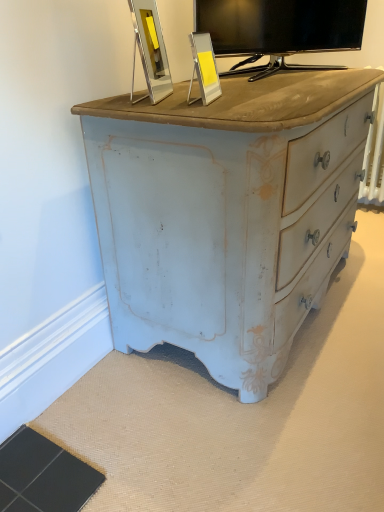
How much space does silver metallic picture frame at upper center, the 2th picture frame from the right, occupy horizontally?

It is 2.15 inches.

At what (x,y) coordinates should I click in order to perform the action: click on metallic silver picture frame at upper center, acting as the 2th picture frame starting from the left. Please return your answer as a coordinate pair (x, y). The width and height of the screenshot is (384, 512). Looking at the image, I should click on (204, 68).

I want to click on picture frame on the right of silver metallic picture frame at upper center, the 2th picture frame from the right, so click(x=204, y=68).

From the image's perspective, is silver metallic picture frame at upper center, the 2th picture frame from the right, above or below metallic silver picture frame at upper center, which is the 1th picture frame from right to left?

From the image's perspective, silver metallic picture frame at upper center, the 2th picture frame from the right, appears above metallic silver picture frame at upper center, which is the 1th picture frame from right to left.

From a real-world perspective, which object stands above the other?

silver metallic picture frame at upper center, which is the first picture frame from left to right, is physically above.

Can you confirm if silver metallic picture frame at upper center, which is the first picture frame from left to right, is smaller than metallic silver picture frame at upper center, acting as the 2th picture frame starting from the left?

No.

How different are the orientations of silver metallic picture frame at upper center, which is the first picture frame from left to right, and matte black tv at upper center in degrees?

They differ by 55.9 degrees in their facing directions.

Which object is closer to the camera taking this photo, silver metallic picture frame at upper center, which is the first picture frame from left to right, or matte black tv at upper center?

silver metallic picture frame at upper center, which is the first picture frame from left to right, is closer to the camera.

Would you say matte black tv at upper center is part of silver metallic picture frame at upper center, the 2th picture frame from the right,'s contents?

No, silver metallic picture frame at upper center, the 2th picture frame from the right, does not contain matte black tv at upper center.

Identify the location of television on the right of silver metallic picture frame at upper center, which is the first picture frame from left to right. (279, 30).

The height and width of the screenshot is (512, 384). What are the coordinates of `picture frame behind the silver metallic picture frame at upper center, the 2th picture frame from the right` in the screenshot? It's located at (204, 68).

Is metallic silver picture frame at upper center, acting as the 2th picture frame starting from the left, not within silver metallic picture frame at upper center, which is the first picture frame from left to right?

That's correct, metallic silver picture frame at upper center, acting as the 2th picture frame starting from the left, is outside of silver metallic picture frame at upper center, which is the first picture frame from left to right.

Which of these two, metallic silver picture frame at upper center, acting as the 2th picture frame starting from the left, or silver metallic picture frame at upper center, the 2th picture frame from the right, stands shorter?

Standing shorter between the two is metallic silver picture frame at upper center, acting as the 2th picture frame starting from the left.

In terms of width, does metallic silver picture frame at upper center, acting as the 2th picture frame starting from the left, look wider or thinner when compared to silver metallic picture frame at upper center, which is the first picture frame from left to right?

In the image, metallic silver picture frame at upper center, acting as the 2th picture frame starting from the left, appears to be more narrow than silver metallic picture frame at upper center, which is the first picture frame from left to right.

From the image's perspective, is metallic silver picture frame at upper center, which is the 1th picture frame from right to left, located above or below matte black tv at upper center?

metallic silver picture frame at upper center, which is the 1th picture frame from right to left, is below matte black tv at upper center.

Do you think metallic silver picture frame at upper center, acting as the 2th picture frame starting from the left, is within matte black tv at upper center, or outside of it?

metallic silver picture frame at upper center, acting as the 2th picture frame starting from the left, is not inside matte black tv at upper center, it's outside.

Who is more distant, metallic silver picture frame at upper center, acting as the 2th picture frame starting from the left, or matte black tv at upper center?

matte black tv at upper center is further from the camera.

Considering the sizes of objects metallic silver picture frame at upper center, acting as the 2th picture frame starting from the left, and matte black tv at upper center in the image provided, who is shorter, metallic silver picture frame at upper center, acting as the 2th picture frame starting from the left, or matte black tv at upper center?

metallic silver picture frame at upper center, acting as the 2th picture frame starting from the left.

Looking at the image, does matte black tv at upper center seem bigger or smaller compared to silver metallic picture frame at upper center, which is the first picture frame from left to right?

matte black tv at upper center is bigger than silver metallic picture frame at upper center, which is the first picture frame from left to right.

Choose the correct answer: Is matte black tv at upper center inside silver metallic picture frame at upper center, which is the first picture frame from left to right, or outside it?

matte black tv at upper center is not enclosed by silver metallic picture frame at upper center, which is the first picture frame from left to right.

From a real-world perspective, is matte black tv at upper center physically below silver metallic picture frame at upper center, the 2th picture frame from the right?

No, from a real-world perspective, matte black tv at upper center is not under silver metallic picture frame at upper center, the 2th picture frame from the right.

Considering the relative sizes of matte black tv at upper center and metallic silver picture frame at upper center, which is the 1th picture frame from right to left, in the image provided, is matte black tv at upper center smaller than metallic silver picture frame at upper center, which is the 1th picture frame from right to left,?

Actually, matte black tv at upper center might be larger than metallic silver picture frame at upper center, which is the 1th picture frame from right to left.

Considering the positions of objects matte black tv at upper center and metallic silver picture frame at upper center, acting as the 2th picture frame starting from the left, in the image provided, who is more to the right, matte black tv at upper center or metallic silver picture frame at upper center, acting as the 2th picture frame starting from the left,?

matte black tv at upper center.

Is matte black tv at upper center positioned before metallic silver picture frame at upper center, which is the 1th picture frame from right to left?

That is False.

From a real-world perspective, relative to metallic silver picture frame at upper center, which is the 1th picture frame from right to left, is matte black tv at upper center vertically above or below?

matte black tv at upper center is above metallic silver picture frame at upper center, which is the 1th picture frame from right to left.

Identify the location of picture frame that appears on the left of metallic silver picture frame at upper center, which is the 1th picture frame from right to left. (150, 50).

From the image's perspective, count 1st picture frames downward from the matte black tv at upper center and point to it. Please provide its 2D coordinates.

[(150, 50)]

Estimate the real-world distances between objects in this image. Which object is further from matte black tv at upper center, silver metallic picture frame at upper center, the 2th picture frame from the right, or metallic silver picture frame at upper center, acting as the 2th picture frame starting from the left?

metallic silver picture frame at upper center, acting as the 2th picture frame starting from the left.

Considering their positions, is matte black tv at upper center positioned closer to silver metallic picture frame at upper center, the 2th picture frame from the right, than metallic silver picture frame at upper center, acting as the 2th picture frame starting from the left?

metallic silver picture frame at upper center, acting as the 2th picture frame starting from the left, lies closer to silver metallic picture frame at upper center, the 2th picture frame from the right, than the other object.

Estimate the real-world distances between objects in this image. Which object is closer to matte black tv at upper center, metallic silver picture frame at upper center, acting as the 2th picture frame starting from the left, or silver metallic picture frame at upper center, the 2th picture frame from the right?

silver metallic picture frame at upper center, the 2th picture frame from the right, lies closer to matte black tv at upper center than the other object.

When comparing their distances from metallic silver picture frame at upper center, acting as the 2th picture frame starting from the left, does silver metallic picture frame at upper center, which is the first picture frame from left to right, or matte black tv at upper center seem closer?

silver metallic picture frame at upper center, which is the first picture frame from left to right.

Which object lies further to the anchor point metallic silver picture frame at upper center, acting as the 2th picture frame starting from the left, matte black tv at upper center or silver metallic picture frame at upper center, which is the first picture frame from left to right?

Among the two, matte black tv at upper center is located further to metallic silver picture frame at upper center, acting as the 2th picture frame starting from the left.

Estimate the real-world distances between objects in this image. Which object is further from silver metallic picture frame at upper center, the 2th picture frame from the right, metallic silver picture frame at upper center, acting as the 2th picture frame starting from the left, or matte black tv at upper center?

Based on the image, matte black tv at upper center appears to be further to silver metallic picture frame at upper center, the 2th picture frame from the right.

Find the location of a particular element. Image resolution: width=384 pixels, height=512 pixels. picture frame between silver metallic picture frame at upper center, which is the first picture frame from left to right, and matte black tv at upper center is located at coordinates (204, 68).